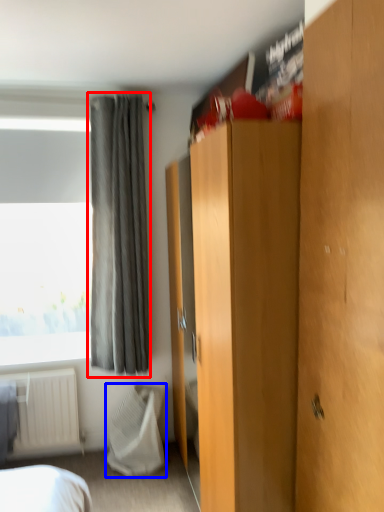
Question: Which object is closer to the camera taking this photo, curtain (highlighted by a red box) or blanket (highlighted by a blue box)?

Choices:
 (A) curtain
 (B) blanket

Answer: (A)